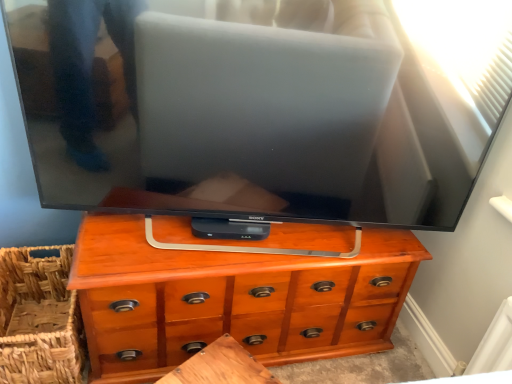
Question: Considering the relative sizes of woven brown basket at lower left and wooden chest of drawers at center in the image provided, is woven brown basket at lower left thinner than wooden chest of drawers at center?

Choices:
 (A) yes
 (B) no

Answer: (B)

Question: From the image's perspective, is woven brown basket at lower left over wooden chest of drawers at center?

Choices:
 (A) no
 (B) yes

Answer: (A)

Question: Considering the relative sizes of woven brown basket at lower left and wooden chest of drawers at center in the image provided, is woven brown basket at lower left taller than wooden chest of drawers at center?

Choices:
 (A) yes
 (B) no

Answer: (B)

Question: Is the depth of woven brown basket at lower left greater than that of wooden chest of drawers at center?

Choices:
 (A) yes
 (B) no

Answer: (A)

Question: From the image's perspective, would you say woven brown basket at lower left is shown under wooden chest of drawers at center?

Choices:
 (A) yes
 (B) no

Answer: (A)

Question: Would you say wooden chest of drawers at center is to the left or to the right of wooden table at center in the picture?

Choices:
 (A) right
 (B) left

Answer: (A)

Question: From a real-world perspective, is wooden chest of drawers at center positioned above or below wooden table at center?

Choices:
 (A) above
 (B) below

Answer: (A)

Question: In terms of size, does wooden chest of drawers at center appear bigger or smaller than wooden table at center?

Choices:
 (A) big
 (B) small

Answer: (A)

Question: Considering the positions of wooden chest of drawers at center and wooden table at center in the image, is wooden chest of drawers at center taller or shorter than wooden table at center?

Choices:
 (A) short
 (B) tall

Answer: (B)

Question: Based on their sizes in the image, would you say wooden chest of drawers at center is bigger or smaller than woven brown basket at lower left?

Choices:
 (A) small
 (B) big

Answer: (B)

Question: Relative to woven brown basket at lower left, is wooden chest of drawers at center in front or behind?

Choices:
 (A) front
 (B) behind

Answer: (A)

Question: Considering the positions of point (378, 264) and point (74, 354), is point (378, 264) closer or farther from the camera than point (74, 354)?

Choices:
 (A) closer
 (B) farther

Answer: (B)

Question: From the image's perspective, is wooden chest of drawers at center above or below woven brown basket at lower left?

Choices:
 (A) above
 (B) below

Answer: (A)

Question: In terms of size, does woven brown basket at lower left appear bigger or smaller than wooden table at center?

Choices:
 (A) big
 (B) small

Answer: (A)

Question: Would you say woven brown basket at lower left is inside or outside wooden table at center?

Choices:
 (A) inside
 (B) outside

Answer: (B)